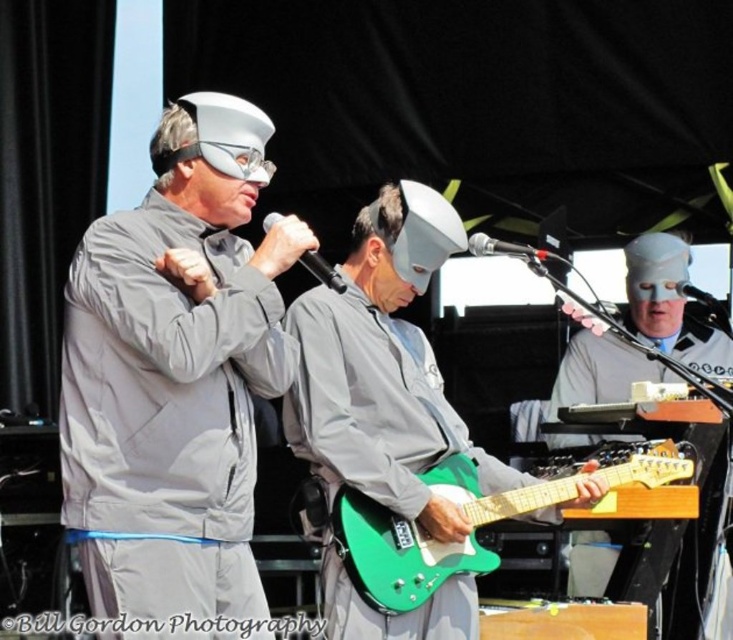
You are sitting in the front row of the stage and want to point out two specific points on the stage. The first point is at coordinates point (210, 444) and the second is at point (658, 346). Which point is closer to you?

Point (210, 444) is closer to the viewer than point (658, 346).

You are a stagehand setting up a new light at coordinates 0.6, 0.25. Is the light likely to shine on the matte gray suit at center?

The matte gray suit at center is located at coordinates (174,372), so the light at (183,384) is very close and likely to shine on it.

You are a stagehand setting up for a performance. You need to place the green matte electric guitar at center and the green glossy electric guitar at center on the stage. If the stage has limited space, which guitar should you choose to fit better in a smaller area?

The green glossy electric guitar at center should be chosen because it is smaller in size than the green matte electric guitar at center, making it better suited for a smaller space.